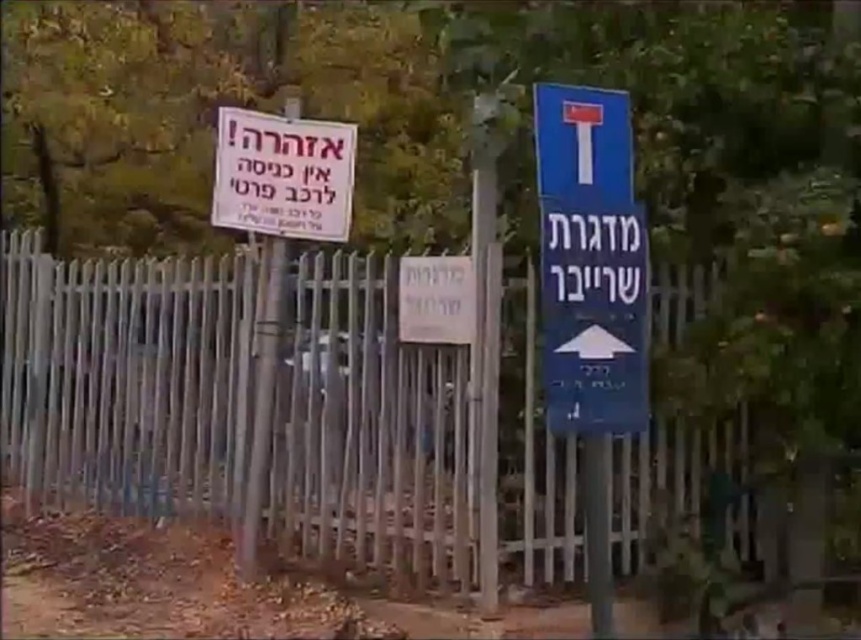
Question: From the image, what is the correct spatial relationship of silver metallic fence at center in relation to blue plastic sign at right?

Choices:
 (A) right
 (B) left

Answer: (B)

Question: Among these objects, which one is farthest from the camera?

Choices:
 (A) silver metallic fence at center
 (B) white paper sign at upper left
 (C) blue plastic sign at right

Answer: (B)

Question: Is silver metallic fence at center positioned in front of blue plastic sign at right?

Choices:
 (A) no
 (B) yes

Answer: (A)

Question: Based on their relative distances, which object is farther from the blue plastic sign at right?

Choices:
 (A) white paper sign at upper left
 (B) silver metallic fence at center

Answer: (A)

Question: Is blue plastic sign at right positioned in front of white paper sign at upper left?

Choices:
 (A) no
 (B) yes

Answer: (B)

Question: Which object is positioned farthest from the silver metallic fence at center?

Choices:
 (A) white paper sign at upper left
 (B) blue plastic sign at right

Answer: (B)